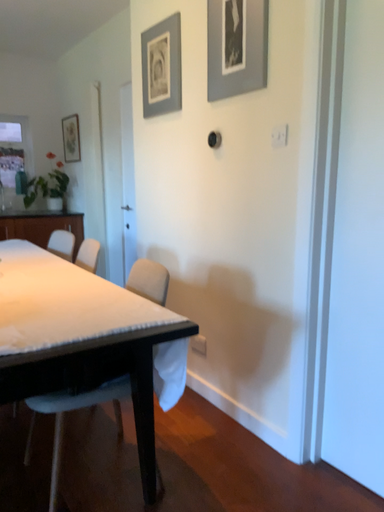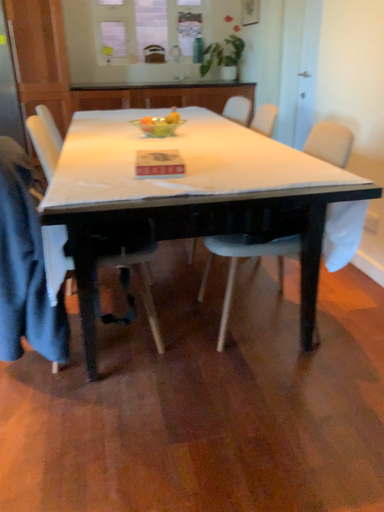
Question: Which way did the camera rotate in the video?

Choices:
 (A) rotated left
 (B) rotated right

Answer: (A)